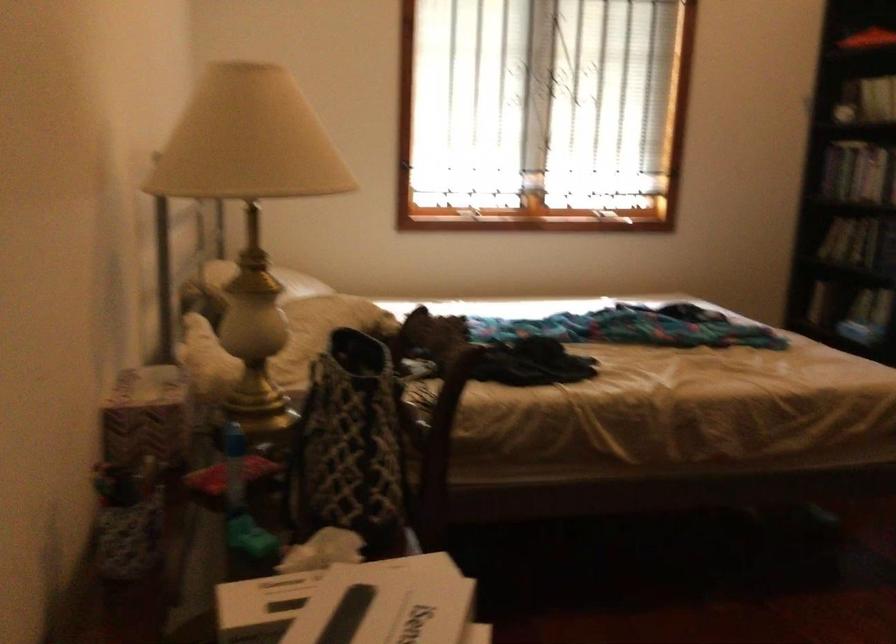
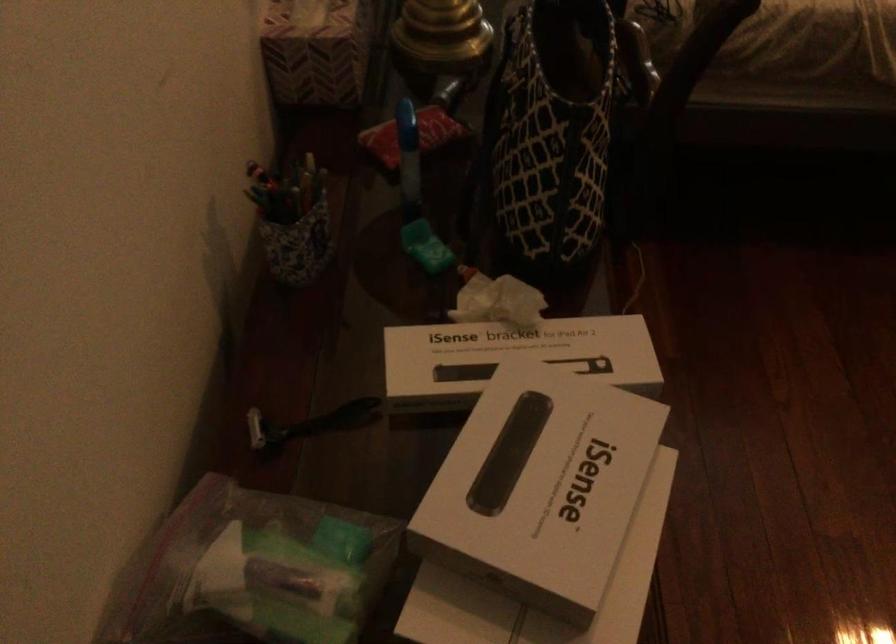
Where in the second image is the point corresponding to (338,564) from the first image?

(515, 353)